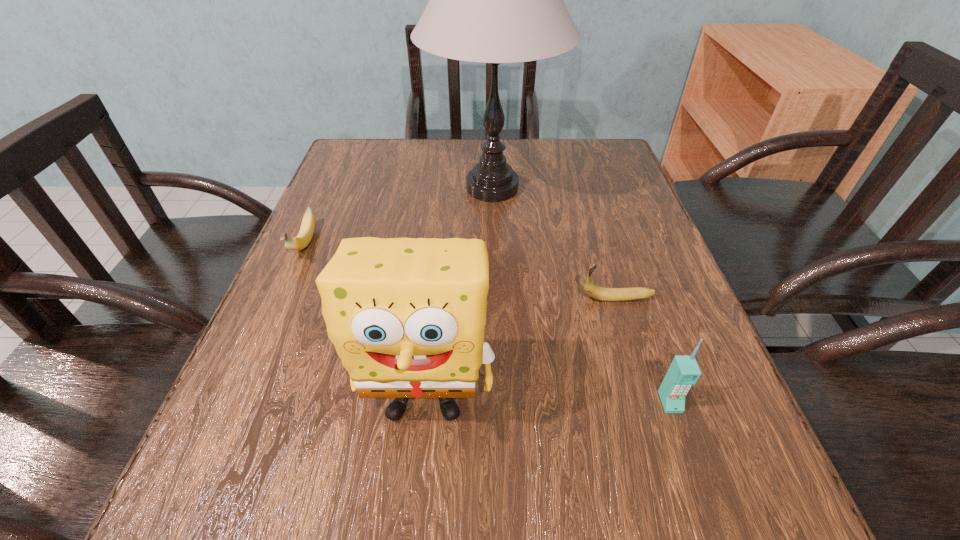
Locate an element on the screen. object that is the third closest to the lamp is located at coordinates (407, 316).

Image resolution: width=960 pixels, height=540 pixels. Identify the location of object that is the closest one to the nearer banana. (684, 371).

You are a GUI agent. You are given a task and a screenshot of the screen. Output one action in this format:
    pyautogui.click(x=<x>, y=<y>)
    Task: Click on the vacant space that satisfies the following two spatial constraints: 1. at the stem of the right banana; 2. on the face of the second tallest object
    The width and height of the screenshot is (960, 540).
    Given the screenshot: What is the action you would take?
    pyautogui.click(x=648, y=400)

You are a GUI agent. You are given a task and a screenshot of the screen. Output one action in this format:
    pyautogui.click(x=<x>, y=<y>)
    Task: Click on the free region that satisfies the following two spatial constraints: 1. at the stem of the third farthest object; 2. on the face of the sponge
    Image resolution: width=960 pixels, height=540 pixels.
    Given the screenshot: What is the action you would take?
    pyautogui.click(x=648, y=400)